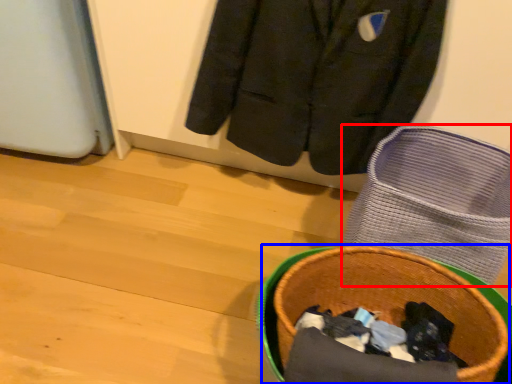
Question: Which object appears closest to the camera in this image, footwear (highlighted by a red box) or basket container (highlighted by a blue box)?

Choices:
 (A) footwear
 (B) basket container

Answer: (B)